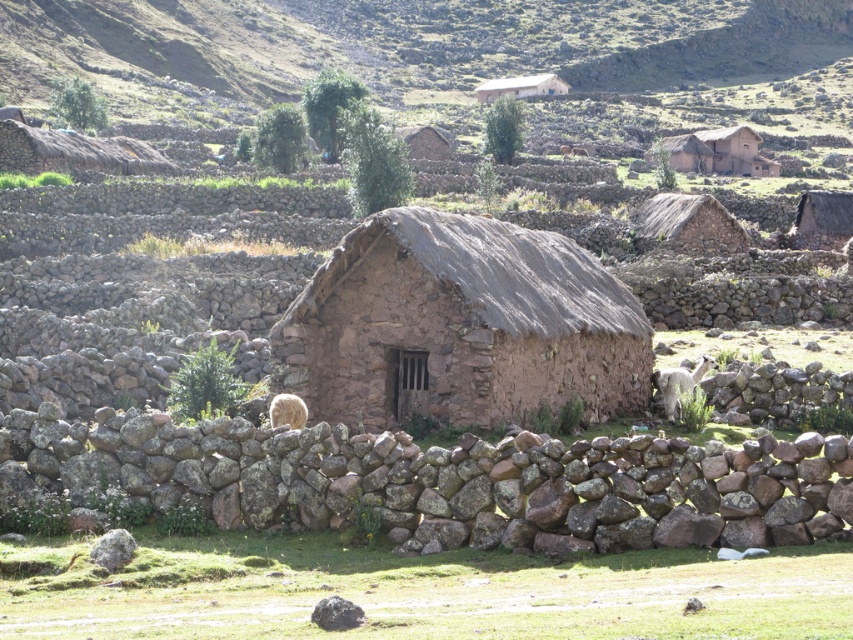
Question: Considering the relative positions of brown mud hut at center and thatched straw hut at upper center in the image provided, where is brown mud hut at center located with respect to thatched straw hut at upper center?

Choices:
 (A) right
 (B) left

Answer: (B)

Question: Which point is closer to the camera?

Choices:
 (A) thatched straw hut at upper center
 (B) brown mud hut at center
 (C) green grass at lower center

Answer: (C)

Question: Can you confirm if brown stone hut at center is positioned above fuzzy white sheep at lower left?

Choices:
 (A) yes
 (B) no

Answer: (A)

Question: Which object appears closest to the camera in this image?

Choices:
 (A) white woolen llama at right
 (B) rustic stone hut at upper center

Answer: (A)

Question: Which object is closer to the camera taking this photo?

Choices:
 (A) fuzzy white sheep at lower left
 (B) brown rock wall at center
 (C) rustic stone hut at upper center

Answer: (B)

Question: Is green grass at lower center smaller than thatched straw hut at upper center?

Choices:
 (A) yes
 (B) no

Answer: (A)